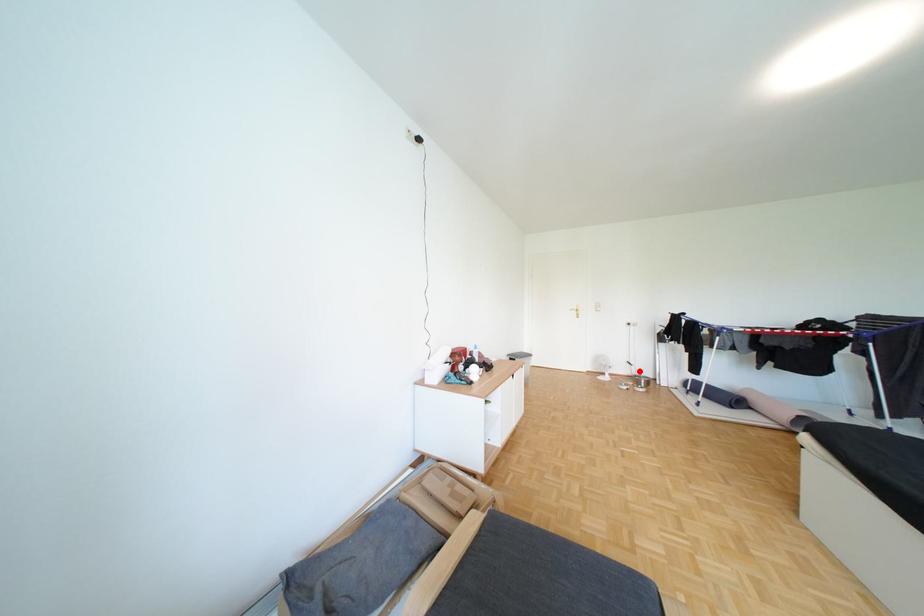
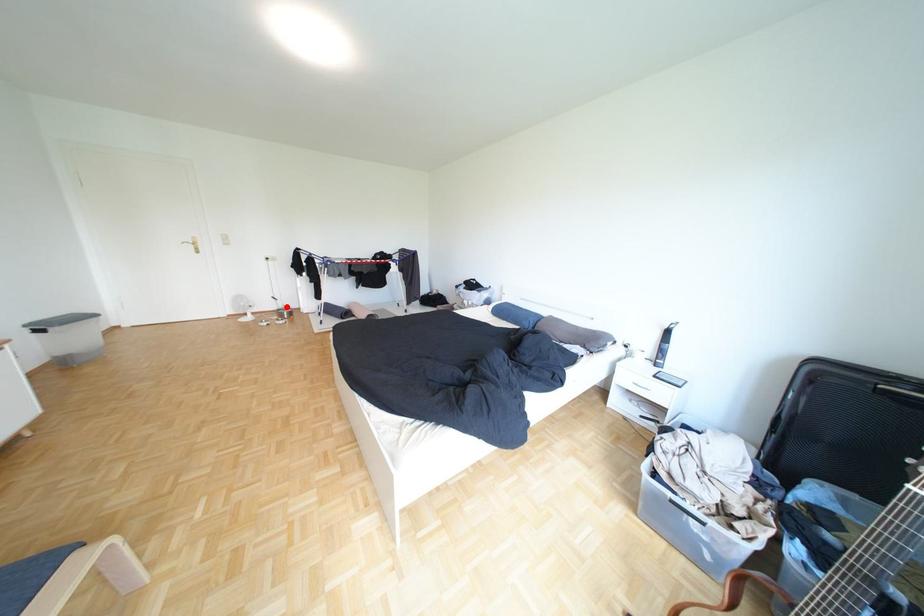
Looking at this image, I am providing you with two images of the same scene from different viewpoints. A red point is marked on the first image and another point is marked on the second image. Is the red point in image1 aligned with the point shown in image2?

Yes